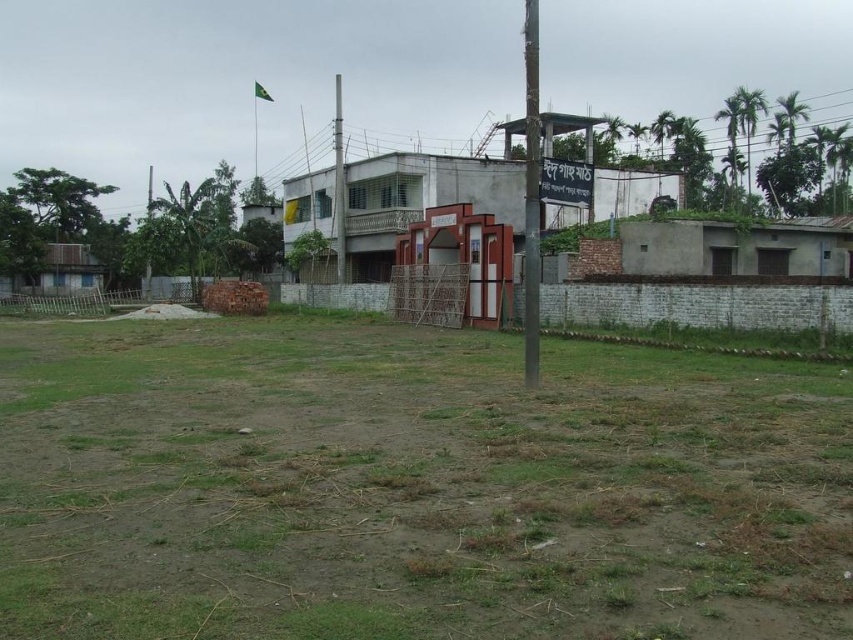
You are standing at the point with coordinates 0.5, 0.5 in the image. You want to walk to the green grassy field at center. Which direction should you move in?

The green grassy field at center is located at point (412, 486). Since you are at (426, 320), you should move towards the northeast direction to reach it.

You are a gardener planning to plant flowers in the green grassy field at center and the smooth metallic pole at center. Which location has more space for planting?

The smooth metallic pole at center has more space for planting since the green grassy field at center is smaller in size compared to it.

You are standing in the outdoor scene and want to walk towards the white plastic signboard at center. Which direction should you move relative to the green grassy field at center?

Since the green grassy field at center is closer to the viewer than the white plastic signboard at center, you should move away from the green grassy field at center to reach the white plastic signboard at center.